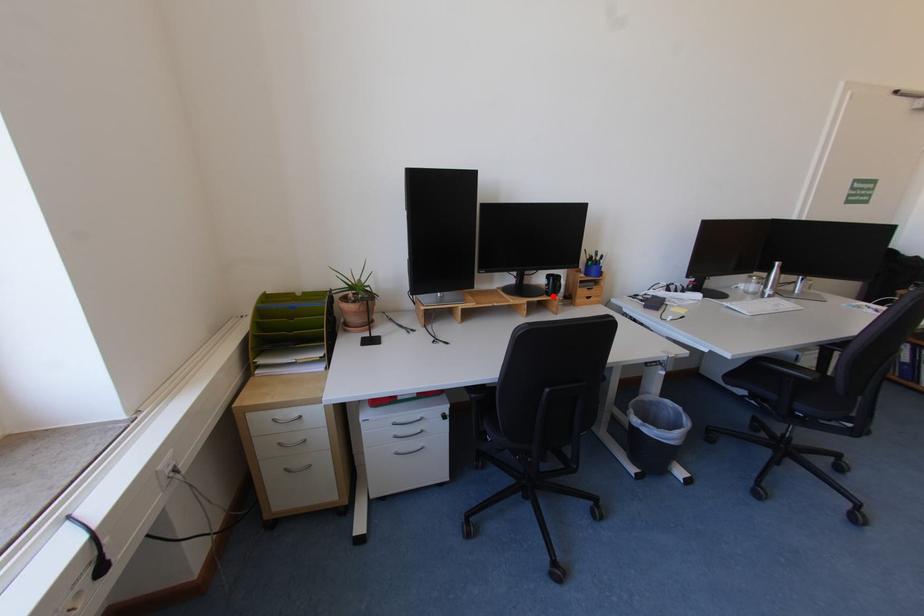
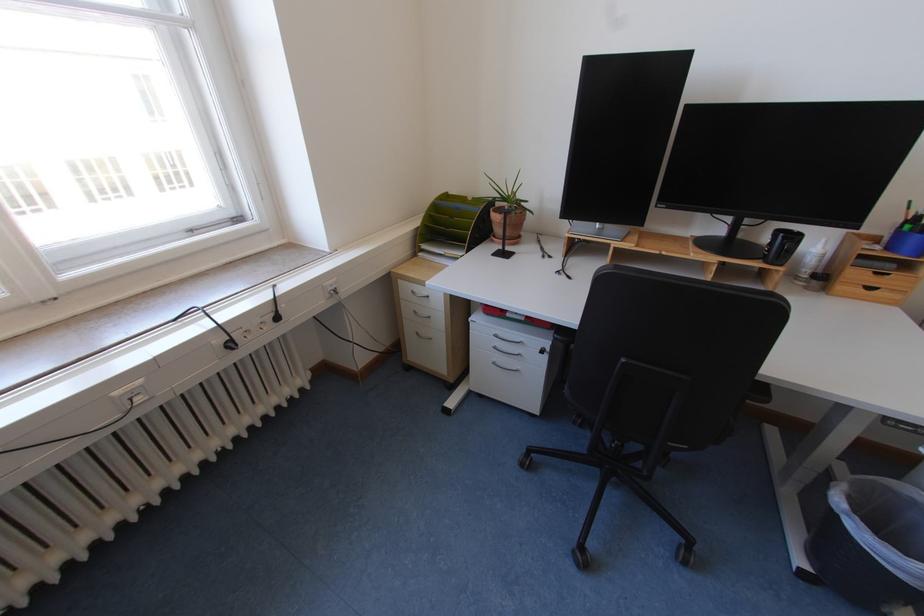
Where in the second image is the point corresponding to the highlighted location from the first image?

(769, 262)